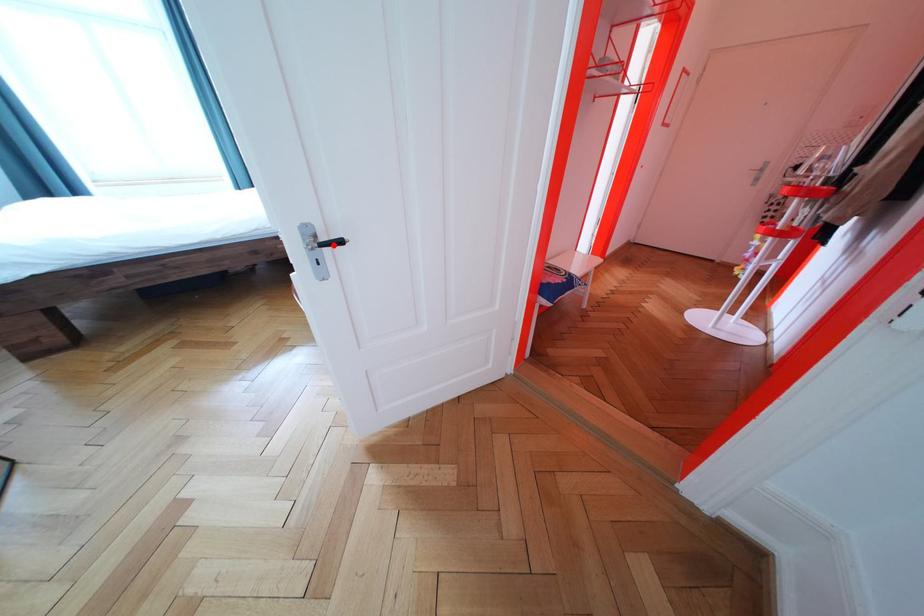
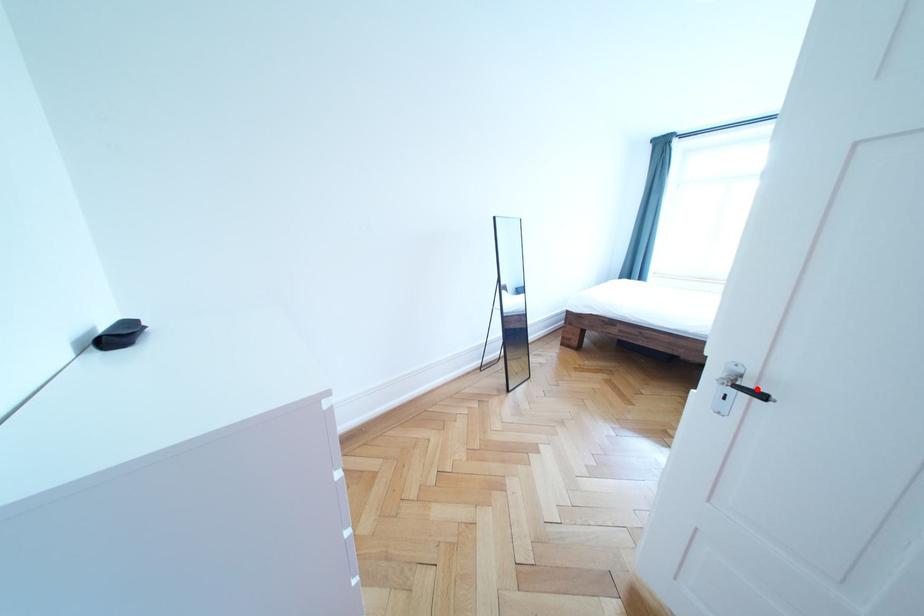
I am providing you with two images of the same scene from different viewpoints. A red point is marked on the first image and another point is marked on the second image. Do the highlighted points in image1 and image2 indicate the same real-world spot?

Yes